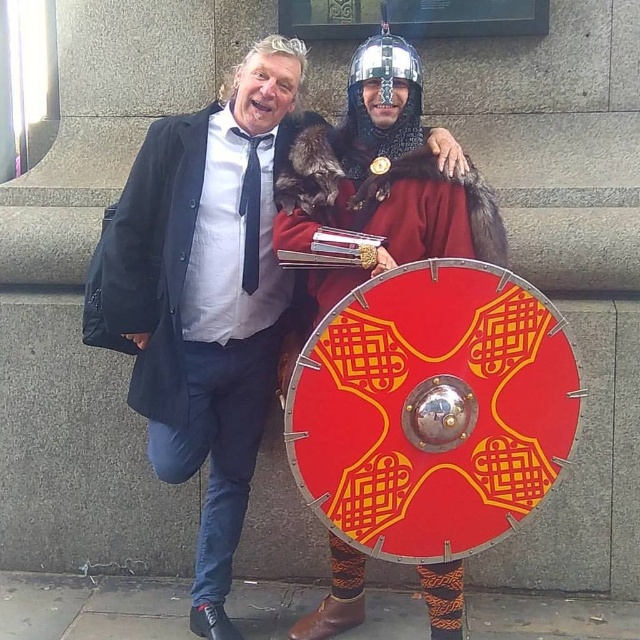
Can you confirm if matte red shield at center is smaller than shiny silver helmet at center?

No.

Is matte red shield at center wider than shiny silver helmet at center?

Yes.

I want to click on matte red shield at center, so click(x=204, y=296).